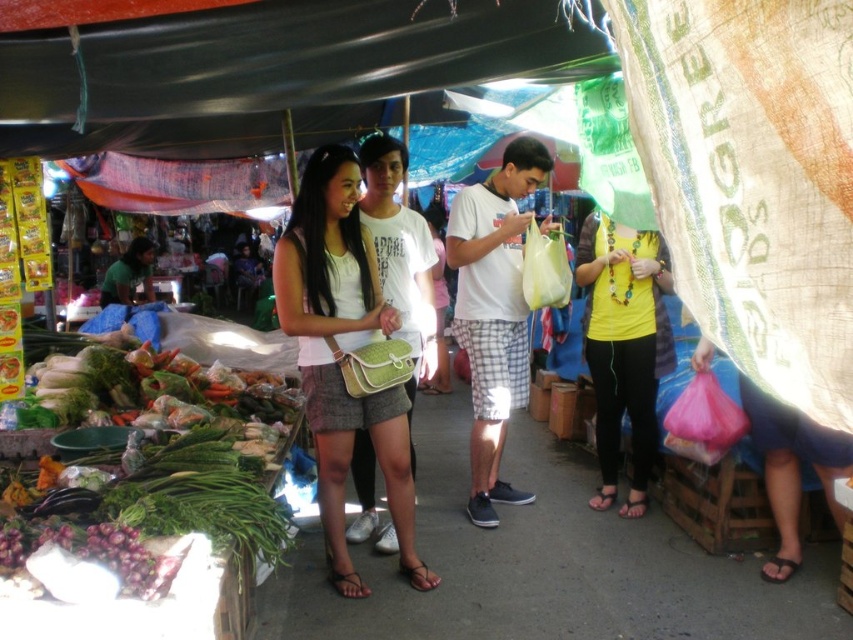
Looking at this image, you are a customer at the market and want to carry your purchases in the white matte plastic bag at center. However, you also have a yellow matte shirt at center that you need to bring along. Given their sizes, can you fit both items into the bag without overstuffing it?

The white matte plastic bag at center is larger than the yellow matte shirt at center, so it should be possible to fit the yellow matte shirt at center inside the white matte plastic bag at center without overstuffing it.

You are standing at the entrance of the market and see two points marked in the scene. The first point is at coordinates point (358,592) and the second is at point (589,308). Which point is closer to you?

Point (358,592) is in front of point (589,308), so it is closer to you.